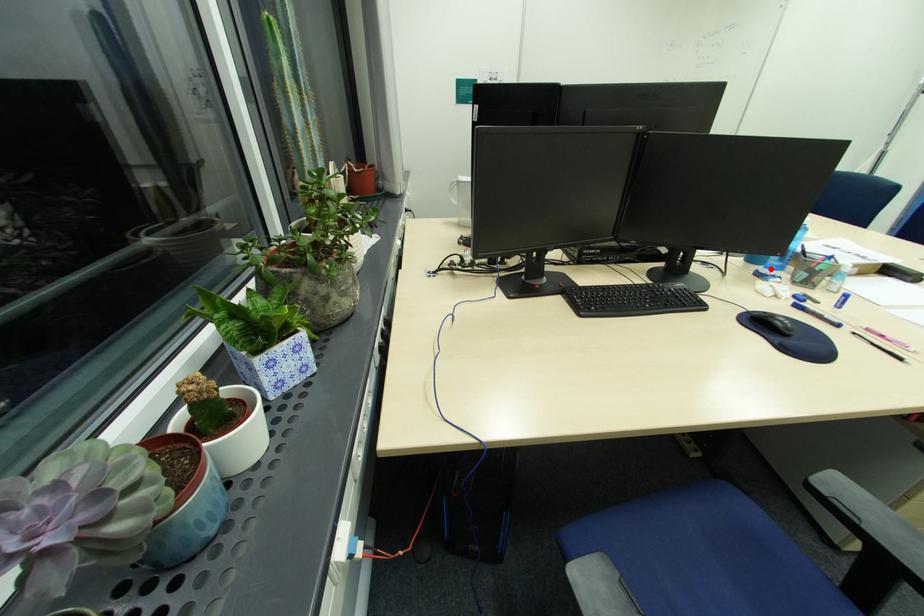
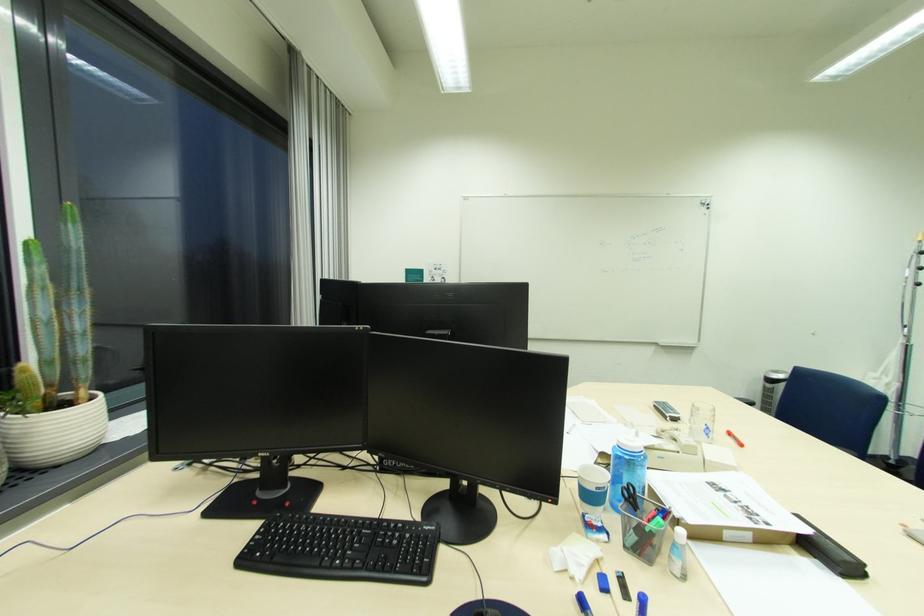
Question: I am providing you with two images of the same scene from different viewpoints. A red point is marked on the first image. At the location where the point appears in image 1, is it still visible in image 2?

Choices:
 (A) Yes
 (B) No

Answer: (A)